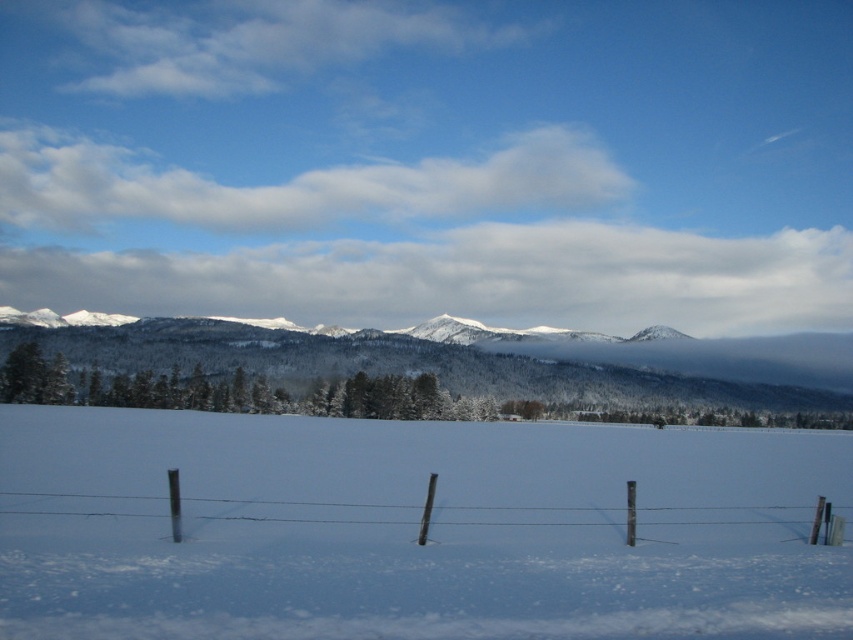
You are an observer standing in the winter landscape. You see the white powdery snow at center and the wooden post wire fence at lower center. Which object covers a larger area in the scene?

The white powdery snow at center covers a larger area than the wooden post wire fence at lower center according to the description.